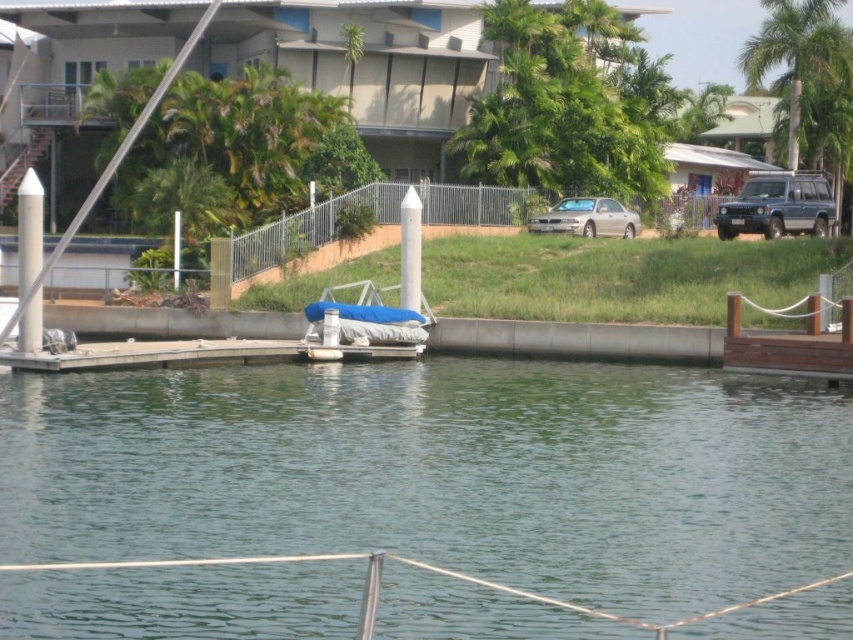
Question: Which object is farther from the camera taking this photo?

Choices:
 (A) brown wooden dock at right
 (B) green leafy palm tree at upper right

Answer: (B)

Question: Is green water at center to the left of satin silver car at center from the viewer's perspective?

Choices:
 (A) yes
 (B) no

Answer: (A)

Question: Does green water at center have a greater width compared to blue fabric boat at center?

Choices:
 (A) yes
 (B) no

Answer: (A)

Question: Which of the following is the farthest from the observer?

Choices:
 (A) brown wooden dock at right
 (B) silver metallic suv at upper right

Answer: (B)

Question: Considering the relative positions of green leafy palm tree at upper right and silver metallic suv at upper right in the image provided, where is green leafy palm tree at upper right located with respect to silver metallic suv at upper right?

Choices:
 (A) above
 (B) below

Answer: (A)

Question: Which object is the closest to the brown wooden dock at right?

Choices:
 (A) satin silver car at center
 (B) silver metallic suv at upper right
 (C) blue fabric boat at center

Answer: (C)